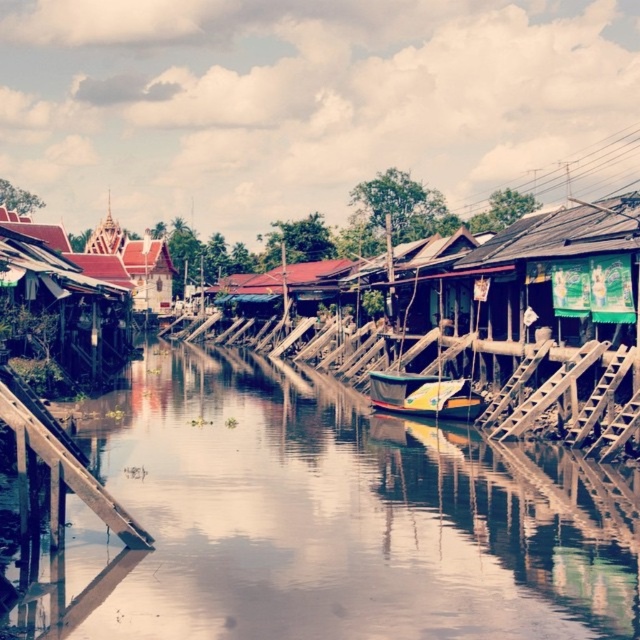
Is brown wooden river at center to the right of wooden boat at center from the viewer's perspective?

No, brown wooden river at center is not to the right of wooden boat at center.

Find the location of a particular element. brown wooden river at center is located at coordinates (326, 520).

At what (x,y) coordinates should I click in order to perform the action: click on brown wooden river at center. Please return your answer as a coordinate pair (x, y). Image resolution: width=640 pixels, height=640 pixels. Looking at the image, I should click on (326, 520).